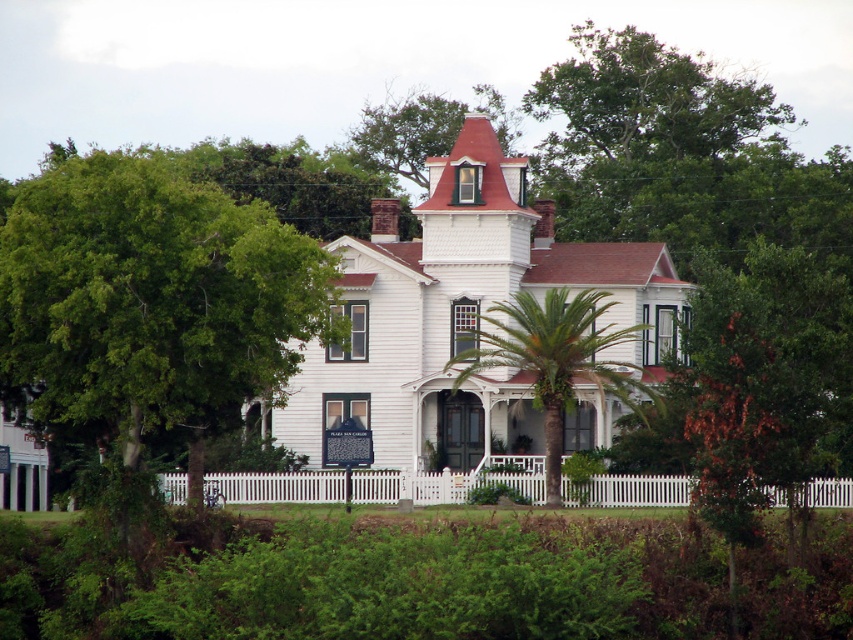
You are standing on the porch of the Victorian house and want to see the green leafy palm tree at center. Which direction should you look to avoid the green leafy tree at lower left blocking your view?

The green leafy tree at lower left is in front of the green leafy palm tree at center. So, to avoid the green leafy tree at lower left blocking the view, you should look towards the right side of the green leafy palm tree at center.

You are standing in front of the Victorian house and want to take a photo. You notice two points marked on the image. Which point, point (x=131, y=301) or point (x=601, y=378), is closer to you?

Point (x=131, y=301) is closer to the camera than point (x=601, y=378), so it is closer to you.

You are a painter standing at the front gate of the house. You want to paint both the green leafy tree at lower left and the green leafy palm tree at center. Which tree will require you to lift your ladder higher to reach the top?

The green leafy tree at lower left requires lifting the ladder higher because it is taller than the green leafy palm tree at center.